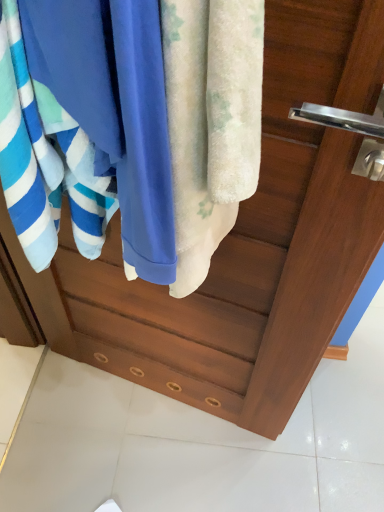
Question: Does blue soft towel at left, which is the first towel from left to right, have a smaller size compared to blue cotton towel at center?

Choices:
 (A) yes
 (B) no

Answer: (B)

Question: Can blue cotton towel at center be found inside blue soft towel at left, marked as the 2th towel in a right-to-left arrangement?

Choices:
 (A) no
 (B) yes

Answer: (B)

Question: Is the depth of blue soft towel at left, marked as the 2th towel in a right-to-left arrangement, greater than that of blue cotton towel at center?

Choices:
 (A) yes
 (B) no

Answer: (B)

Question: Does blue soft towel at left, marked as the 2th towel in a right-to-left arrangement, come in front of blue cotton towel at center?

Choices:
 (A) no
 (B) yes

Answer: (B)

Question: Does blue soft towel at left, marked as the 2th towel in a right-to-left arrangement, appear on the left side of blue cotton towel at center?

Choices:
 (A) no
 (B) yes

Answer: (B)

Question: Is blue soft towel at left, marked as the 2th towel in a right-to-left arrangement, wider than blue cotton towel at center?

Choices:
 (A) yes
 (B) no

Answer: (A)

Question: Would you consider fluffy white towel at center, the first towel in the right-to-left sequence, to be distant from blue cotton towel at center?

Choices:
 (A) yes
 (B) no

Answer: (B)

Question: From a real-world perspective, is fluffy white towel at center, the first towel in the right-to-left sequence, below blue cotton towel at center?

Choices:
 (A) yes
 (B) no

Answer: (A)

Question: From a real-world perspective, is fluffy white towel at center, acting as the 2th towel starting from the left, located higher than blue cotton towel at center?

Choices:
 (A) no
 (B) yes

Answer: (A)

Question: Is fluffy white towel at center, the first towel in the right-to-left sequence, taller than blue cotton towel at center?

Choices:
 (A) yes
 (B) no

Answer: (A)

Question: Is fluffy white towel at center, acting as the 2th towel starting from the left, next to blue cotton towel at center and touching it?

Choices:
 (A) no
 (B) yes

Answer: (B)

Question: Is fluffy white towel at center, acting as the 2th towel starting from the left, wider than blue cotton towel at center?

Choices:
 (A) yes
 (B) no

Answer: (A)

Question: Could fluffy white towel at center, acting as the 2th towel starting from the left, be considered to be inside blue cotton towel at center?

Choices:
 (A) no
 (B) yes

Answer: (B)